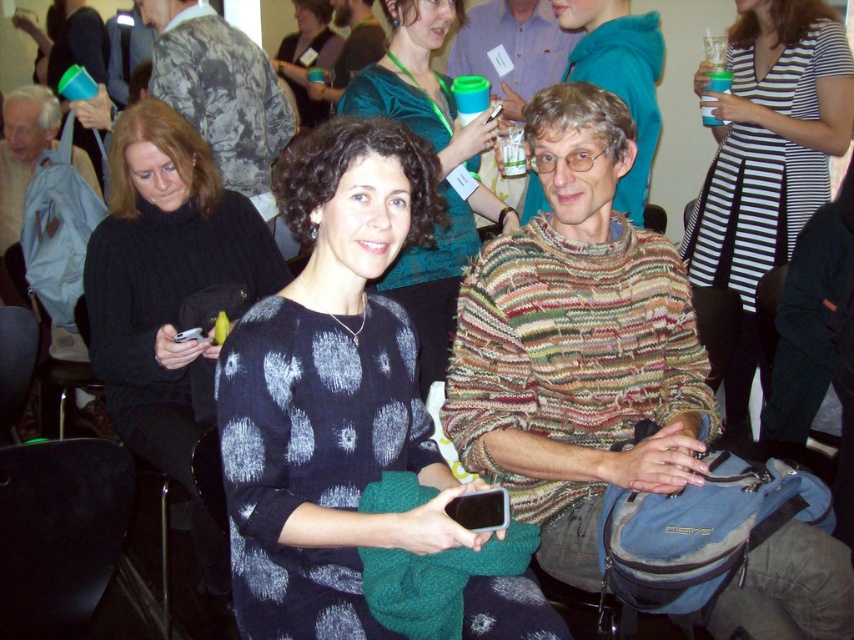
Who is positioned more to the right, dark blue knit sweater at center or matte black sweater at center?

From the viewer's perspective, dark blue knit sweater at center appears more on the right side.

Between point (385, 10) and point (293, 35), which one is positioned in front?

Point (385, 10)

This screenshot has height=640, width=854. Find the location of `dark blue knit sweater at center`. dark blue knit sweater at center is located at coordinates 440,168.

I want to click on dark blue knit sweater at center, so click(x=440, y=168).

From the picture: Which is more to the left, black striped dress at upper center or dark blue knit sweater at center?

From the viewer's perspective, dark blue knit sweater at center appears more on the left side.

Is point (705, 177) positioned in front of point (445, 272)?

No, it is behind (445, 272).

This screenshot has height=640, width=854. In order to click on black striped dress at upper center in this screenshot , I will do `click(765, 156)`.

Locate an element on the screen. black striped dress at upper center is located at coordinates (765, 156).

Which is in front, point (730, 205) or point (302, 109)?

Point (730, 205) is more forward.

The image size is (854, 640). Identify the location of black striped dress at upper center. (765, 156).